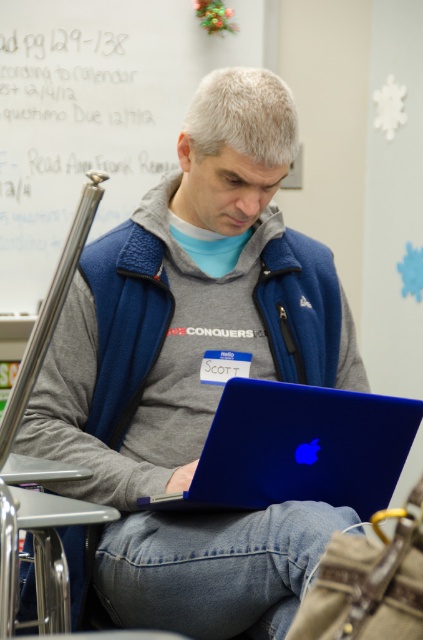
Is point (172, 157) less distant than point (382, 442)?

No, (172, 157) is behind (382, 442).

Who is shorter, whiteboard at upper left or blue glossy laptop at center?

blue glossy laptop at center is shorter.

The image size is (423, 640). I want to click on whiteboard at upper left, so click(x=93, y=113).